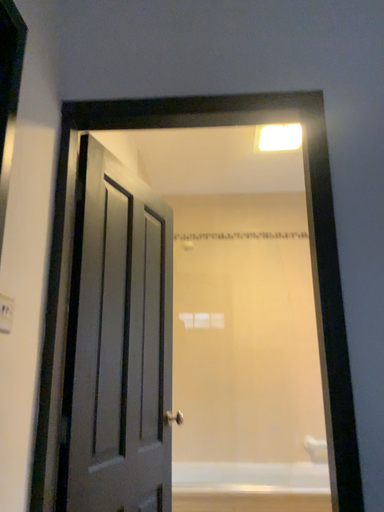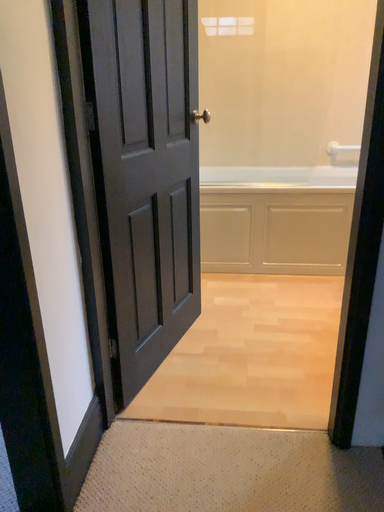
Question: How did the camera likely rotate when shooting the video?

Choices:
 (A) rotated downward
 (B) rotated upward

Answer: (A)